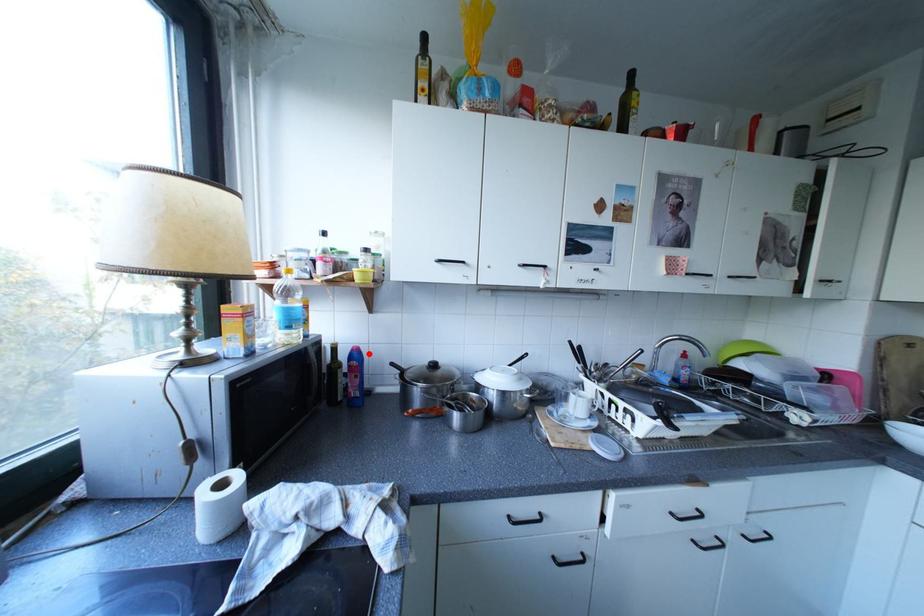
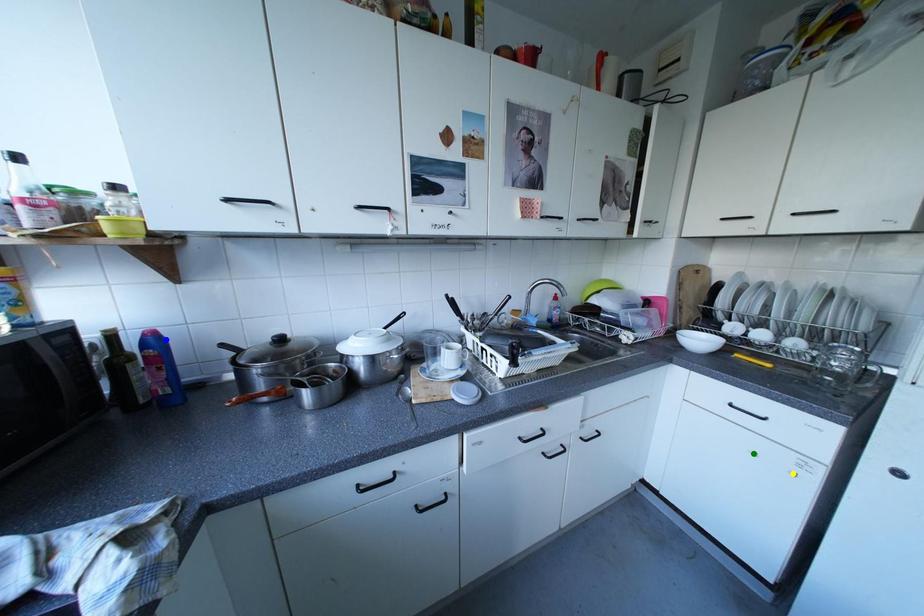
Question: I am providing you with two images of the same scene from different viewpoints. A red point is marked on the first image. You are given multiple points on the second image. Which point in image 2 represents the same 3d spot as the red point in image 1?

Choices:
 (A) yellow point
 (B) blue point
 (C) green point

Answer: (B)